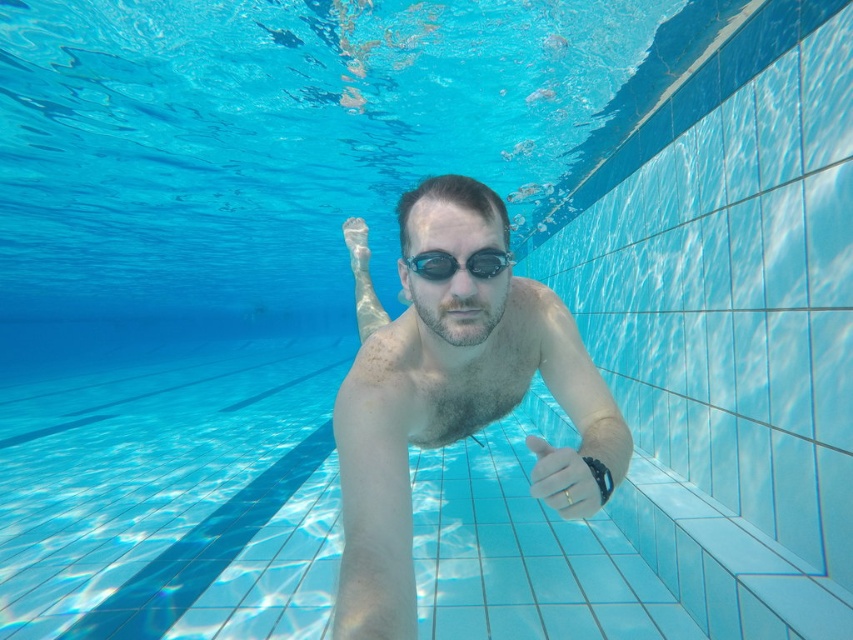
Does white matte hand at center come behind transparent rubber goggles at center?

No, white matte hand at center is closer to the viewer.

Which is above, white matte hand at center or transparent rubber goggles at center?

transparent rubber goggles at center

Is point (567, 461) positioned after point (430, 266)?

No, it is not.

Where is `white matte hand at center`? The height and width of the screenshot is (640, 853). white matte hand at center is located at coordinates (569, 476).

From the picture: Between smooth skin man at center and transparent rubber goggles at center, which one has more height?

smooth skin man at center

Measure the distance between point (405,620) and camera.

They are 35.72 inches apart.

Identify the location of smooth skin man at center. (442, 387).

Can you confirm if smooth skin man at center is positioned to the right of white matte hand at center?

No, smooth skin man at center is not to the right of white matte hand at center.

Is point (421, 403) less distant than point (566, 497)?

No.

In the scene shown: Who is more forward, [521,333] or [590,470]?

Point [590,470]

Where is `smooth skin man at center`? smooth skin man at center is located at coordinates (442, 387).